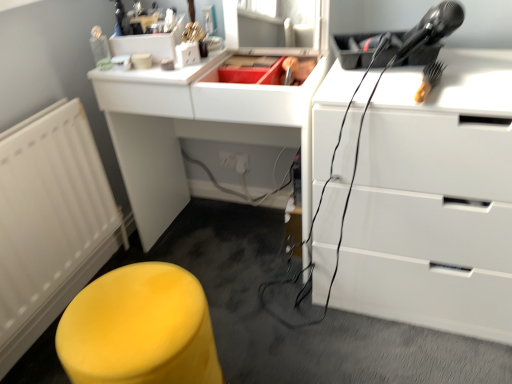
Where is `vacant space situated above matte yellow stool at lower left (from a real-world perspective)`? The image size is (512, 384). vacant space situated above matte yellow stool at lower left (from a real-world perspective) is located at coordinates (128, 307).